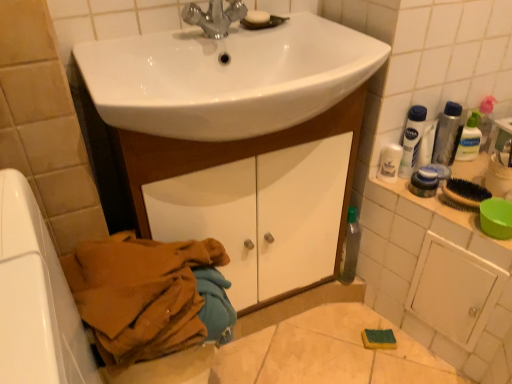
The width and height of the screenshot is (512, 384). I want to click on free space to the left of silver metallic faucet at upper center, so (x=138, y=47).